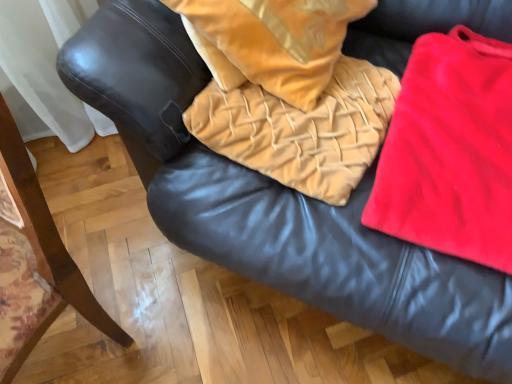
Question: From a real-world perspective, relative to velvet tan blanket at center, is red velvet cloth at right vertically above or below?

Choices:
 (A) above
 (B) below

Answer: (B)

Question: From their relative heights in the image, would you say red velvet cloth at right is taller or shorter than velvet tan blanket at center?

Choices:
 (A) short
 (B) tall

Answer: (A)

Question: Estimate the real-world distances between objects in this image. Which object is farther from the matte black armrest at left?

Choices:
 (A) velvet tan pillow at center
 (B) red velvet cloth at right
 (C) velvet tan blanket at center

Answer: (B)

Question: Estimate the real-world distances between objects in this image. Which object is closer to the velvet tan blanket at center?

Choices:
 (A) velvet tan pillow at center
 (B) matte black armrest at left
 (C) red velvet cloth at right

Answer: (A)